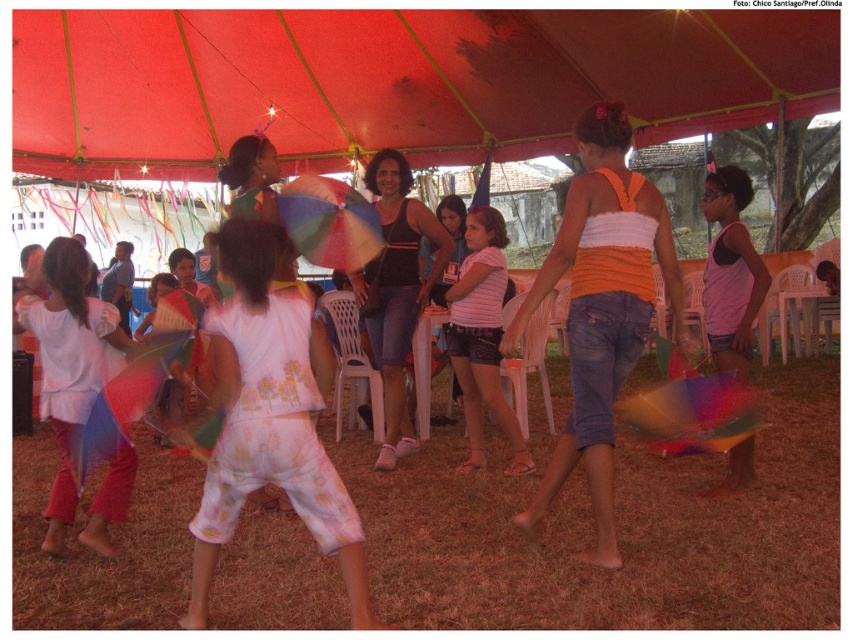
Can you confirm if red fabric canopy at upper center is bigger than pink striped shirt at center?

Indeed, red fabric canopy at upper center has a larger size compared to pink striped shirt at center.

Measure the distance between red fabric canopy at upper center and camera.

red fabric canopy at upper center is 7.33 meters from camera.

Where is `red fabric canopy at upper center`? Image resolution: width=853 pixels, height=640 pixels. red fabric canopy at upper center is located at coordinates (393, 81).

Is white floral-patterned jumpsuit at center to the right of pink striped shirt at center from the viewer's perspective?

Incorrect, white floral-patterned jumpsuit at center is not on the right side of pink striped shirt at center.

Which is more to the left, white floral-patterned jumpsuit at center or pink striped shirt at center?

Positioned to the left is white floral-patterned jumpsuit at center.

What do you see at coordinates (270, 419) in the screenshot?
I see `white floral-patterned jumpsuit at center` at bounding box center [270, 419].

Where is `white floral-patterned jumpsuit at center`? white floral-patterned jumpsuit at center is located at coordinates (270, 419).

Is red fabric canopy at upper center to the left of white floral-patterned jumpsuit at center from the viewer's perspective?

Correct, you'll find red fabric canopy at upper center to the left of white floral-patterned jumpsuit at center.

Is point (283, 67) positioned before point (299, 378)?

That is False.

What are the coordinates of `red fabric canopy at upper center` in the screenshot? It's located at (393, 81).